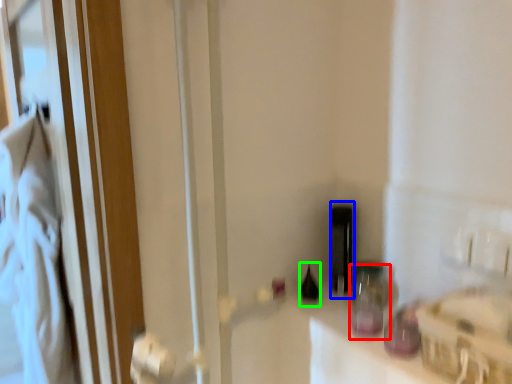
Question: Estimate the real-world distances between objects in this image. Which object is farther from bottle (highlighted by a red box), bottle (highlighted by a blue box) or bottle (highlighted by a green box)?

Choices:
 (A) bottle
 (B) bottle

Answer: (B)